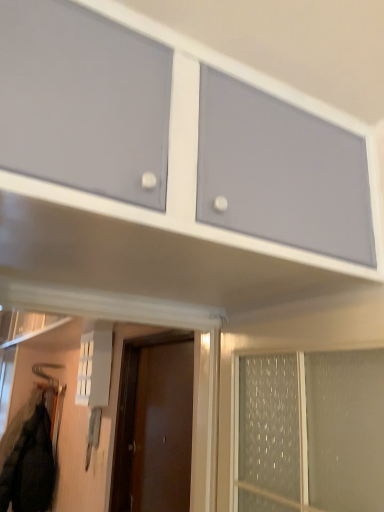
Question: Is point (137, 376) positioned closer to the camera than point (51, 484)?

Choices:
 (A) farther
 (B) closer

Answer: (B)

Question: Would you say brown matte door at center is to the left or to the right of black matte jacket at lower left in the picture?

Choices:
 (A) left
 (B) right

Answer: (B)

Question: Which object is the closest to the matte gray cabinet at upper center?

Choices:
 (A) brown matte door at center
 (B) black matte jacket at lower left

Answer: (A)

Question: Considering the real-world distances, which object is closest to the matte gray cabinet at upper center?

Choices:
 (A) black matte jacket at lower left
 (B) brown matte door at center

Answer: (B)